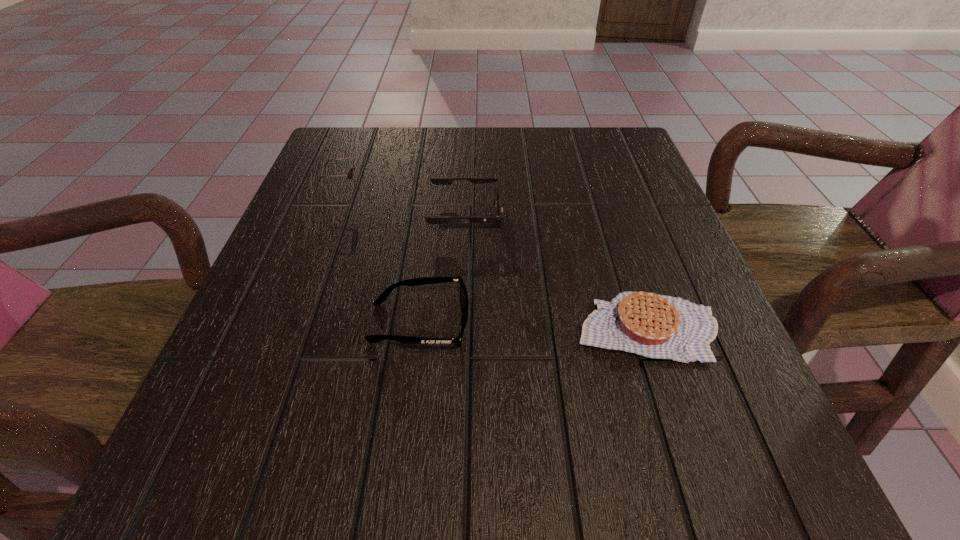
I want to click on unoccupied area between the shortest object and the tallest sunglasses, so click(x=494, y=259).

You are a GUI agent. You are given a task and a screenshot of the screen. Output one action in this format:
    pyautogui.click(x=<x>, y=<y>)
    Task: Click on the empty space that is in between the pie and the tallest sunglasses
    
    Given the screenshot: What is the action you would take?
    pyautogui.click(x=494, y=259)

Where is `object that can be found as the third closest to the leftmost object`? The width and height of the screenshot is (960, 540). object that can be found as the third closest to the leftmost object is located at coordinates (656, 326).

Select which object appears as the closest to the shortest object. Please provide its 2D coordinates. Your answer should be formatted as a tuple, i.e. [(x, y)], where the tuple contains the x and y coordinates of a point satisfying the conditions above.

[(423, 280)]

Identify which sunglasses is the second closest to the tallest sunglasses. Please provide its 2D coordinates. Your answer should be formatted as a tuple, i.e. [(x, y)], where the tuple contains the x and y coordinates of a point satisfying the conditions above.

[(423, 280)]

Choose which sunglasses is the second nearest neighbor to the leftmost sunglasses. Please provide its 2D coordinates. Your answer should be formatted as a tuple, i.e. [(x, y)], where the tuple contains the x and y coordinates of a point satisfying the conditions above.

[(423, 280)]

Locate an element on the screen. The height and width of the screenshot is (540, 960). free region that satisfies the following two spatial constraints: 1. in front of the lenses of the leftmost object; 2. on the left side of the pie is located at coordinates (293, 327).

I want to click on free spot that satisfies the following two spatial constraints: 1. on the front-facing side of the nearest sunglasses; 2. on the back side of the pie, so click(419, 327).

I want to click on vacant region that satisfies the following two spatial constraints: 1. on the front-facing side of the nearest sunglasses; 2. on the right side of the pie, so click(x=419, y=327).

The width and height of the screenshot is (960, 540). Identify the location of free space that satisfies the following two spatial constraints: 1. on the front-facing side of the pie; 2. on the left side of the nearest sunglasses. (419, 327).